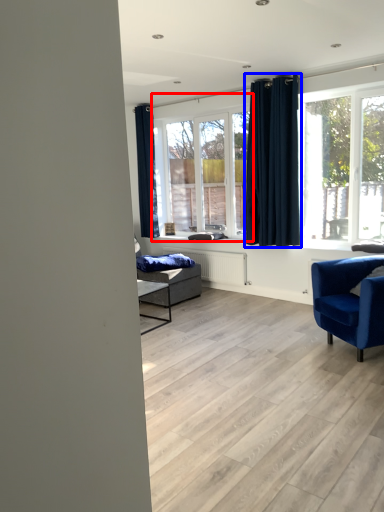
Question: Which object appears farthest to the camera in this image, window (highlighted by a red box) or curtain (highlighted by a blue box)?

Choices:
 (A) window
 (B) curtain

Answer: (A)